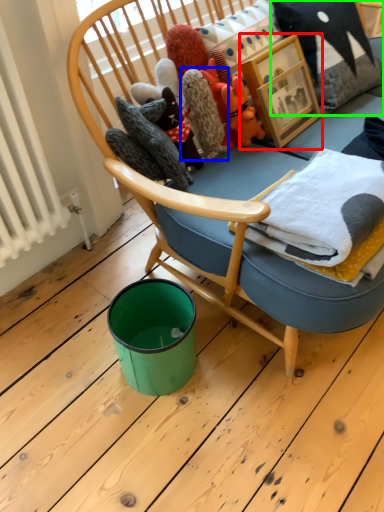
Question: Which object is positioned closest to picture frame (highlighted by a red box)? Select from cloth (highlighted by a blue box) and pillow (highlighted by a green box).

Choices:
 (A) cloth
 (B) pillow

Answer: (B)